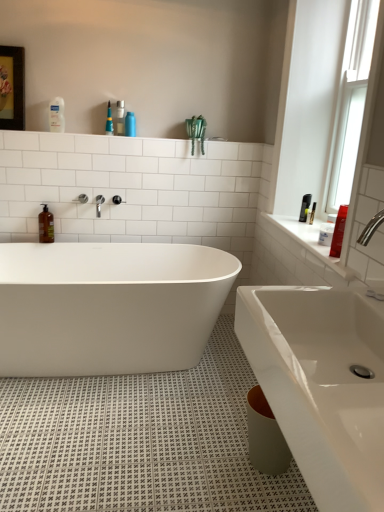
Question: From a real-world perspective, is white glossy bathtub at center located beneath brown glass soap dispenser at left?

Choices:
 (A) yes
 (B) no

Answer: (A)

Question: Is white glossy bathtub at center located outside brown glass soap dispenser at left?

Choices:
 (A) no
 (B) yes

Answer: (B)

Question: Considering the relative sizes of white glossy bathtub at center and brown glass soap dispenser at left in the image provided, is white glossy bathtub at center shorter than brown glass soap dispenser at left?

Choices:
 (A) yes
 (B) no

Answer: (B)

Question: Is the surface of white glossy bathtub at center in direct contact with brown glass soap dispenser at left?

Choices:
 (A) no
 (B) yes

Answer: (A)

Question: Could you tell me if white glossy bathtub at center is facing brown glass soap dispenser at left?

Choices:
 (A) no
 (B) yes

Answer: (A)

Question: Considering their positions, is clear glass window at upper right located in front of or behind white glossy bathtub at center?

Choices:
 (A) front
 (B) behind

Answer: (A)

Question: Based on their positions, is clear glass window at upper right located to the left or right of white glossy bathtub at center?

Choices:
 (A) right
 (B) left

Answer: (A)

Question: From the image's perspective, is clear glass window at upper right located above or below white glossy bathtub at center?

Choices:
 (A) below
 (B) above

Answer: (B)

Question: Looking at their shapes, would you say clear glass window at upper right is wider or thinner than white glossy bathtub at center?

Choices:
 (A) wide
 (B) thin

Answer: (B)

Question: Is white glossy bathtub at center inside or outside of white glossy sink at lower right?

Choices:
 (A) outside
 (B) inside

Answer: (A)

Question: From the image's perspective, is white glossy bathtub at center above or below white glossy sink at lower right?

Choices:
 (A) above
 (B) below

Answer: (A)

Question: Considering the positions of white glossy bathtub at center and white glossy sink at lower right in the image, is white glossy bathtub at center taller or shorter than white glossy sink at lower right?

Choices:
 (A) tall
 (B) short

Answer: (A)

Question: In terms of size, does white glossy bathtub at center appear bigger or smaller than white glossy sink at lower right?

Choices:
 (A) small
 (B) big

Answer: (B)

Question: From the image's perspective, is white glossy sink at lower right located above or below clear glass window at upper right?

Choices:
 (A) below
 (B) above

Answer: (A)

Question: Considering the relative positions of white glossy sink at lower right and clear glass window at upper right in the image provided, is white glossy sink at lower right to the left or to the right of clear glass window at upper right?

Choices:
 (A) right
 (B) left

Answer: (B)